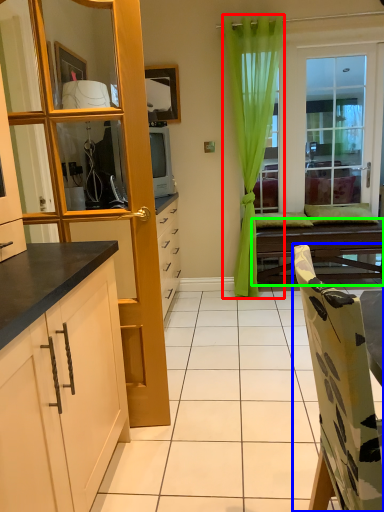
Question: Which object is the farthest from curtain (highlighted by a red box)? Choose among these: chair (highlighted by a blue box) or table (highlighted by a green box).

Choices:
 (A) chair
 (B) table

Answer: (A)